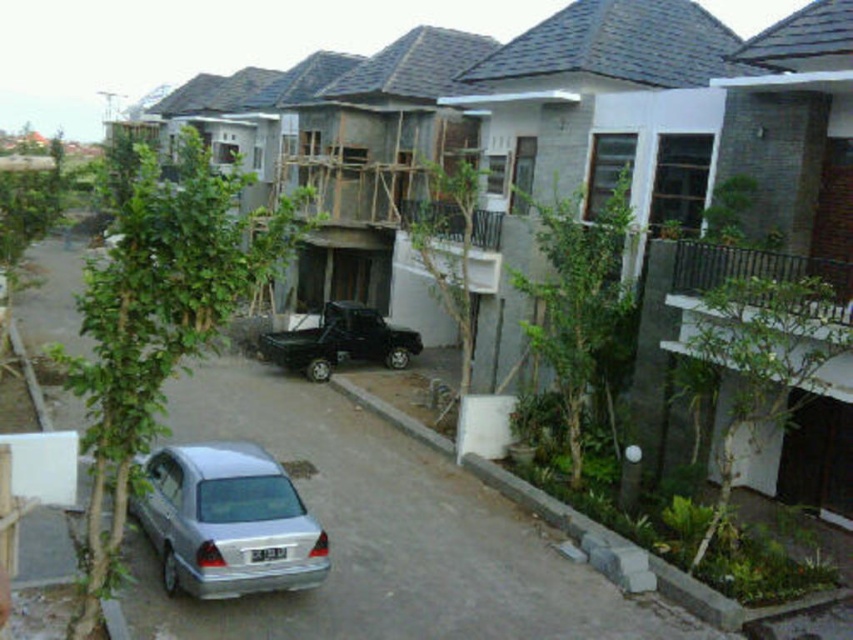
You are a delivery driver who needs to park your truck between the metallic silver car at center and the silver metallic car at lower left. Which side should you choose to ensure there is enough space for your truck?

The metallic silver car at center is wider than the silver metallic car at lower left. Therefore, you should park your truck between the metallic silver car at center and the silver metallic car at lower left on the side of the silver metallic car at lower left, as there is more space available there.

You are a delivery driver needing to park your van between the silver metallic car at lower left and the black matte truck at center. Can your van, which is 2.5 meters wide, fit in the space between them?

The silver metallic car at lower left has a lesser width compared to black matte truck at center. Since the space between them is determined by the distance between the vehicles, not their widths, the description provided does not give information about the actual space between them. Therefore, it is impossible to determine if the van can fit based on the given details.

You are standing at the point marked by the coordinate point at point (228, 522). Which vehicle is directly in front of you? Please choose between the silver metallic car at lower left and the black pickup truck at lower right.

The silver metallic car at lower left is located at point (228, 522), so the vehicle directly in front of you is the silver metallic car at lower left.